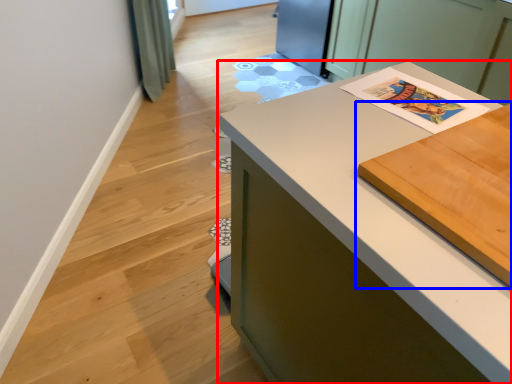
Question: Which point is closer to the camera, countertop (highlighted by a red box) or table (highlighted by a blue box)?

Choices:
 (A) countertop
 (B) table

Answer: (B)